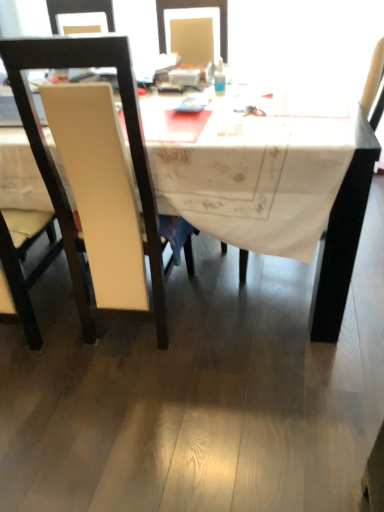
The width and height of the screenshot is (384, 512). In order to click on spots to the right of translucent plastic bottle at upper center in this screenshot , I will do `click(259, 89)`.